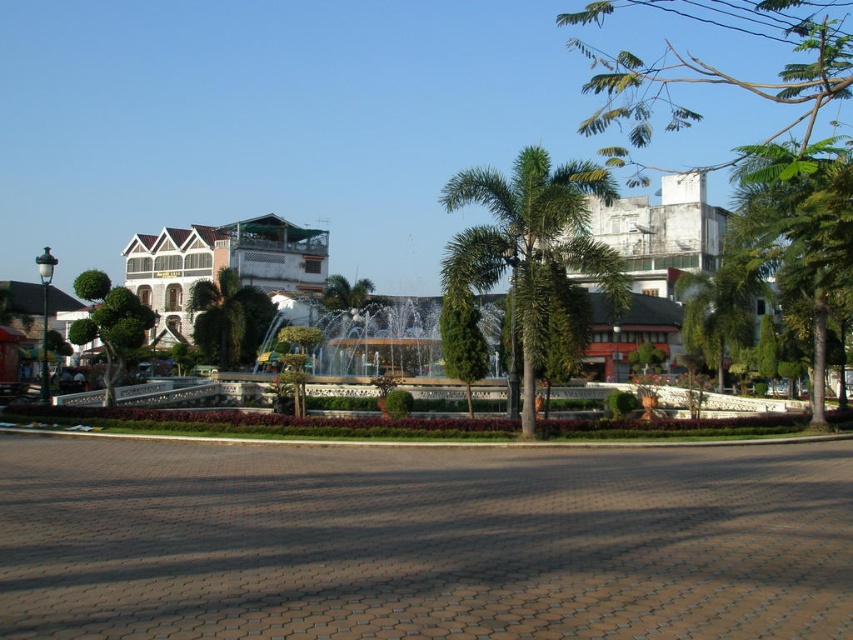
You are standing at the edge of the plaza and want to walk directly to the green leafy palm tree at center. However, there is a green concrete fountain at center in your path. Can you walk around the fountain to reach the palm tree without stepping off the cobblestone pathway?

The green concrete fountain at center is closer to the viewer than the green leafy palm tree at center, so you can walk around the fountain to reach the palm tree while staying on the cobblestone pathway.

You are standing at the edge of the plaza and see the point marked at coordinates (529, 244). Based on the scene description, what object is this point located on?

The point marked at coordinates (529, 244) is located on the green leafy palm tree at center.